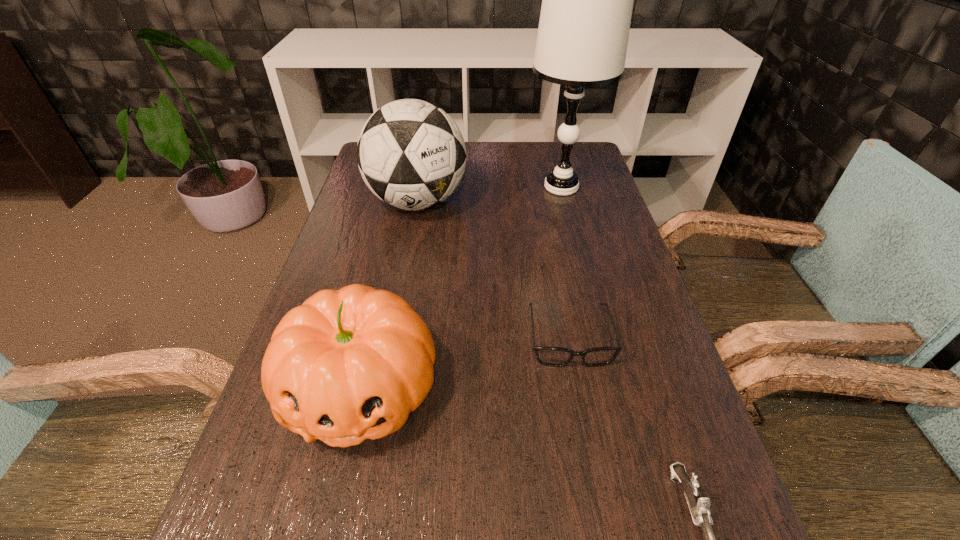
The image size is (960, 540). I want to click on soccer ball that is at the left edge, so click(411, 154).

Identify the location of pumpkin situated at the left edge. (347, 365).

Locate an element on the screen. The image size is (960, 540). table lamp located at the right edge is located at coordinates (587, 0).

The height and width of the screenshot is (540, 960). I want to click on spectacles that is at the right edge, so click(x=550, y=356).

Locate an element on the screen. object situated at the far left corner is located at coordinates tap(411, 154).

Identify the location of object that is at the far right corner. Image resolution: width=960 pixels, height=540 pixels. (587, 0).

The width and height of the screenshot is (960, 540). Identify the location of vacant space at the far edge of the desktop. (510, 170).

This screenshot has width=960, height=540. In order to click on vacant space at the left edge of the desktop in this screenshot , I will do `click(283, 528)`.

Find the location of a particular element. The width and height of the screenshot is (960, 540). free space at the right edge is located at coordinates (589, 231).

This screenshot has height=540, width=960. In the image, there is a desktop. Find the location of `vacant space at the far right corner`. vacant space at the far right corner is located at coordinates (599, 172).